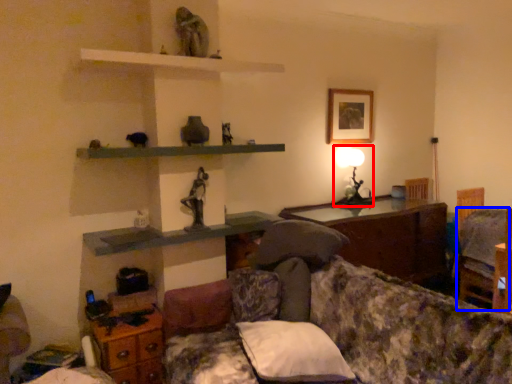
Question: Among these objects, which one is nearest to the camera, table lamp (highlighted by a red box) or swivel chair (highlighted by a blue box)?

Choices:
 (A) table lamp
 (B) swivel chair

Answer: (B)